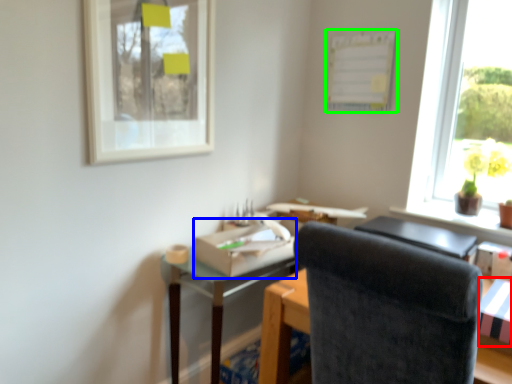
Question: Which is farther away from cardboard box (highlighted by a red box)? cardboard box (highlighted by a blue box) or bulletin board (highlighted by a green box)?

Choices:
 (A) cardboard box
 (B) bulletin board

Answer: (B)